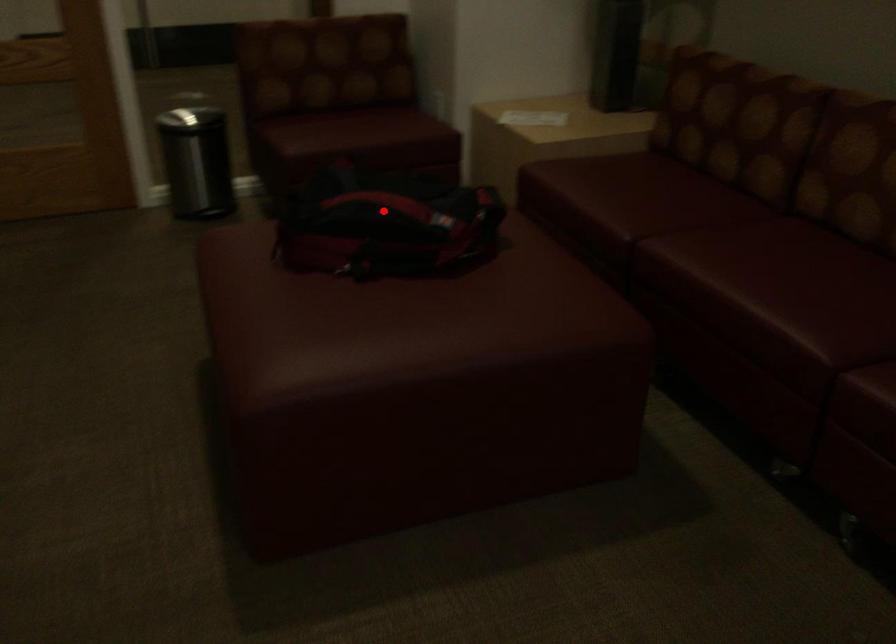
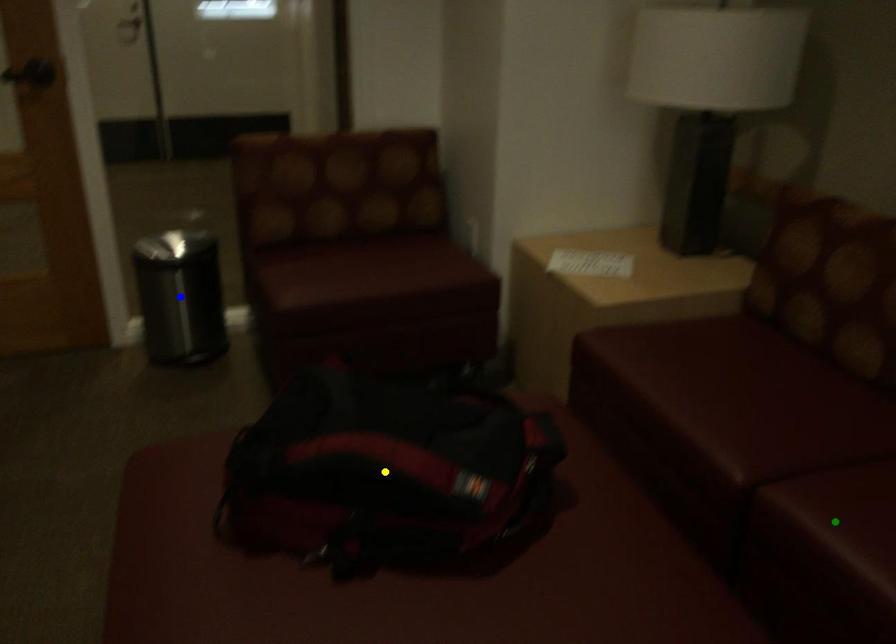
Question: I am providing you with two images of the same scene from different viewpoints. A red point is marked on the first image. You are given multiple points on the second image. Which mark in image 2 goes with the point in image 1?

Choices:
 (A) blue point
 (B) green point
 (C) yellow point

Answer: (C)